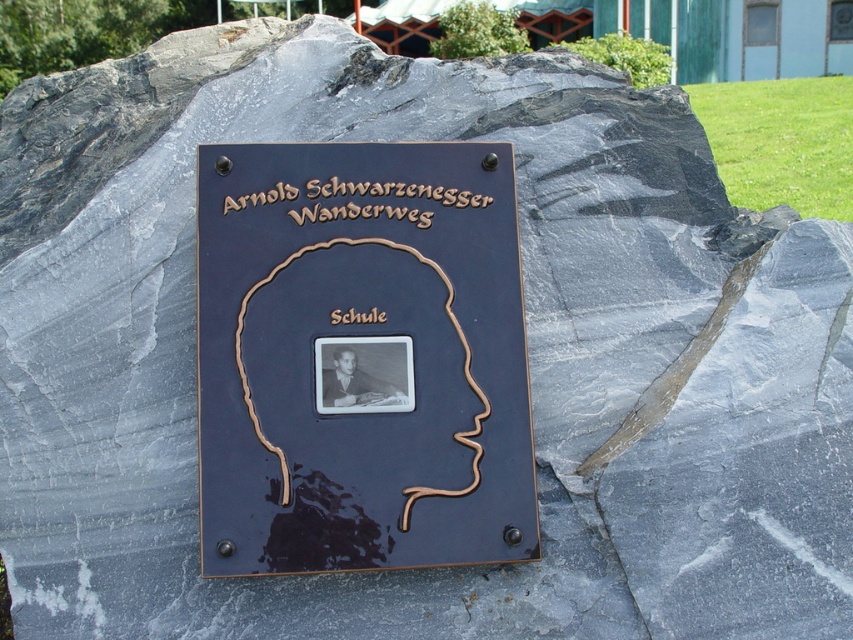
Is bronze plaque at center wider than bronze plaque at upper center?

Correct, the width of bronze plaque at center exceeds that of bronze plaque at upper center.

Is point (489, 380) positioned behind point (483, 195)?

No.

Between point (454, 369) and point (386, 195), which one is positioned behind?

The point (386, 195) is behind.

The height and width of the screenshot is (640, 853). In order to click on bronze plaque at center in this screenshot , I will do `click(361, 358)`.

Which is below, bronze plaque at upper center or brown wood sign at center?

brown wood sign at center is below.

Is the position of bronze plaque at upper center less distant than that of brown wood sign at center?

No, it is not.

Is point (431, 216) less distant than point (337, 321)?

No, (431, 216) is behind (337, 321).

I want to click on bronze plaque at upper center, so click(x=381, y=198).

Consider the image. Who is more forward, (509, 496) or (347, 310)?

Positioned in front is point (509, 496).

Who is taller, bronze plaque at center or brown wood sign at center?

bronze plaque at center

You are a GUI agent. You are given a task and a screenshot of the screen. Output one action in this format:
    pyautogui.click(x=<x>, y=<y>)
    Task: Click on the bronze plaque at center
    Image resolution: width=853 pixels, height=640 pixels.
    Given the screenshot: What is the action you would take?
    pyautogui.click(x=361, y=358)